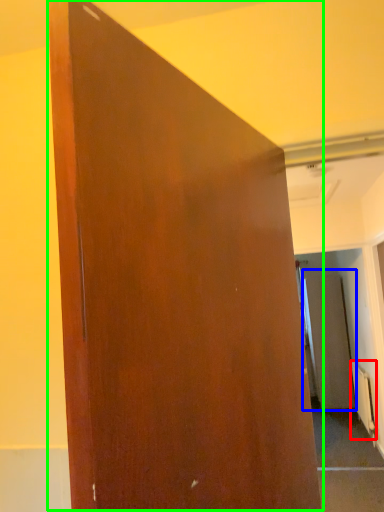
Question: Which object is the closest to the radiator (highlighted by a red box)? Choose among these: screen door (highlighted by a blue box) or door (highlighted by a green box).

Choices:
 (A) screen door
 (B) door

Answer: (A)